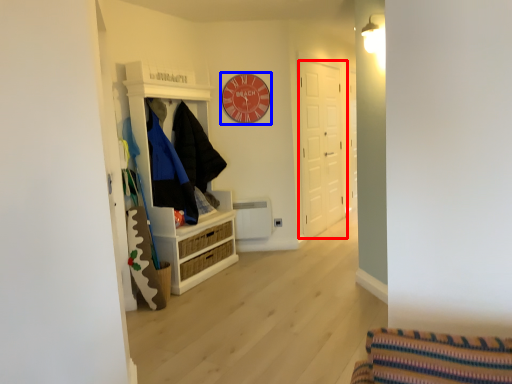
Question: Among these objects, which one is nearest to the camera, door (highlighted by a red box) or clock (highlighted by a blue box)?

Choices:
 (A) door
 (B) clock

Answer: (B)